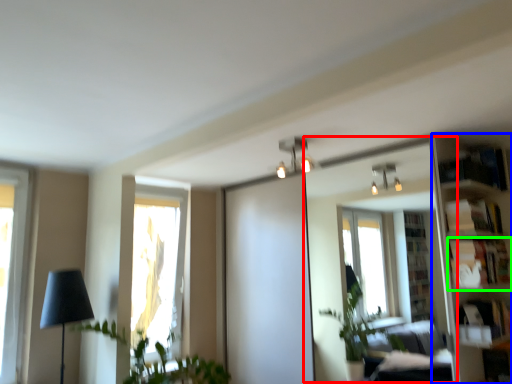
Question: Which object is positioned closest to mirror (highlighted by a red box)? Select from bookshelf (highlighted by a blue box) and shelf (highlighted by a green box).

Choices:
 (A) bookshelf
 (B) shelf

Answer: (A)